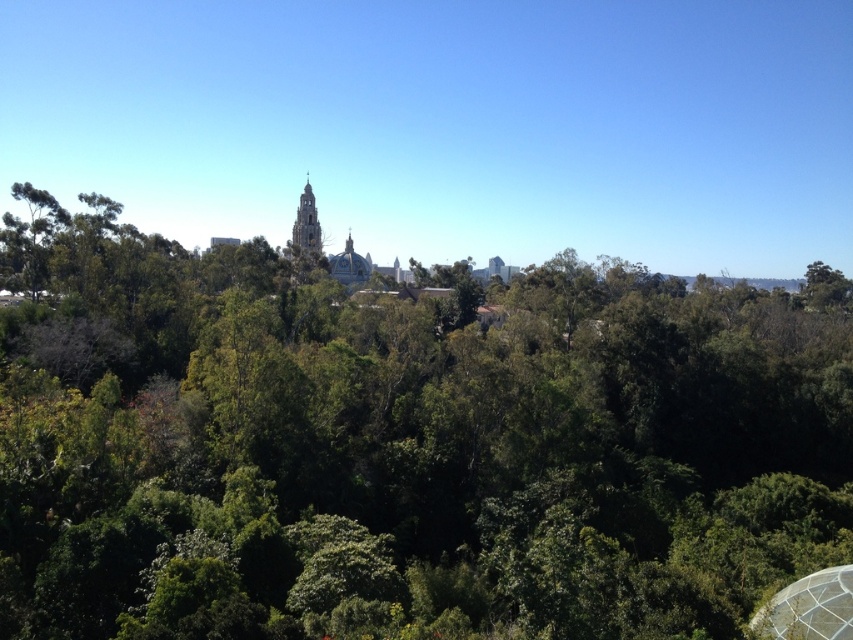
You are standing in the middle of a forest and see a point marked at coordinates (409, 448). What is located at that point?

The point at coordinates (409, 448) indicates green leafy forest at center.

You are standing in the middle of the green leafy forest at center. If you look straight ahead, what do you see in the distance?

In the distance, you can see a cityscape with architectural structures, including a prominent building that has a tall tower and a domed roof.